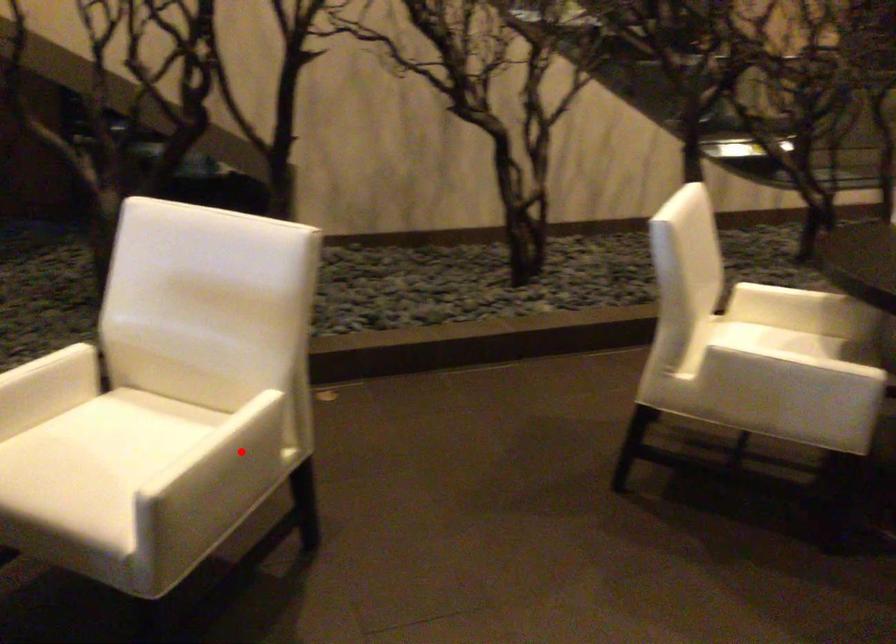
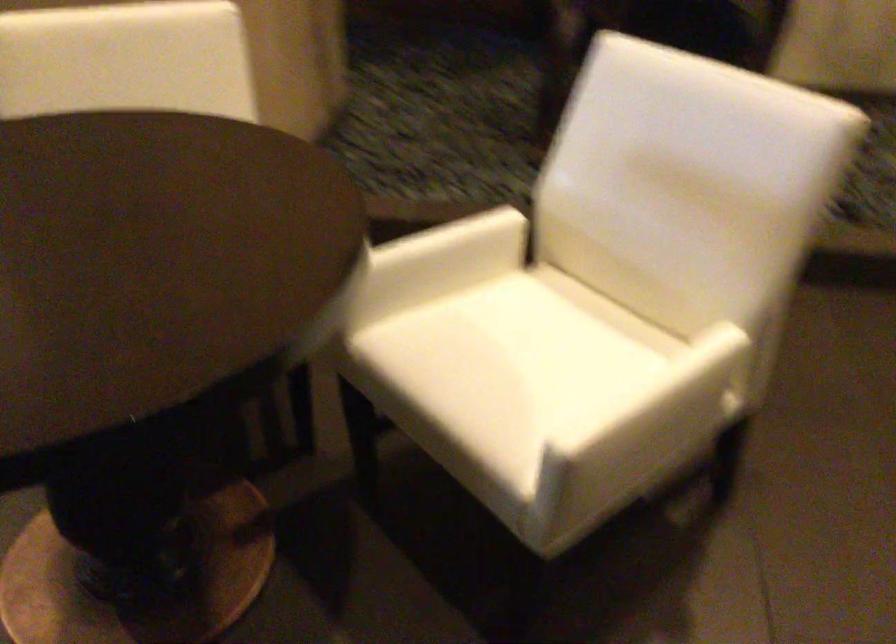
Where in the second image is the point corresponding to the highlighted location from the first image?

(684, 402)